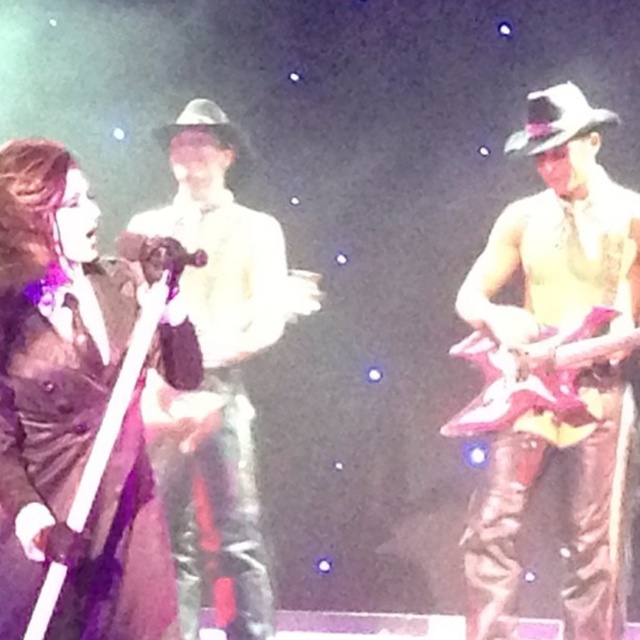
Question: Does matte black hat at center appear on the left side of metallic pink guitar at right?

Choices:
 (A) no
 (B) yes

Answer: (B)

Question: Which is nearer to the shiny metallic guitar at right?

Choices:
 (A) shiny black guitar at left
 (B) metallic pink guitar at right
 (C) matte black hat at center

Answer: (B)

Question: Among these points, which one is nearest to the camera?

Choices:
 (A) (216, 573)
 (B) (588, 216)

Answer: (B)

Question: Which point is closer to the camera taking this photo?

Choices:
 (A) (244, 444)
 (B) (573, 467)
 (C) (472, 401)
 (D) (176, 262)

Answer: (D)

Question: Is metallic pink guitar at right to the right of shiny black guitar at left from the viewer's perspective?

Choices:
 (A) no
 (B) yes

Answer: (B)

Question: Considering the relative positions of metallic pink guitar at right and shiny black guitar at left in the image provided, where is metallic pink guitar at right located with respect to shiny black guitar at left?

Choices:
 (A) right
 (B) left

Answer: (A)